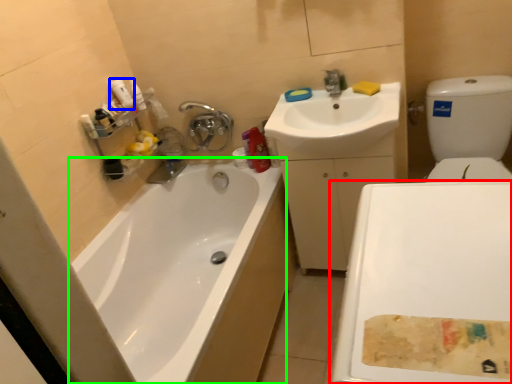
Question: Estimate the real-world distances between objects in this image. Which object is closer to plain (highlighted by a red box), cleaning product (highlighted by a blue box) or bathtub (highlighted by a green box)?

Choices:
 (A) cleaning product
 (B) bathtub

Answer: (B)